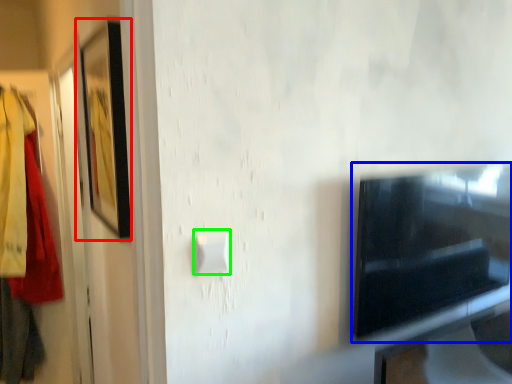
Question: Which is farther away from picture frame (highlighted by a red box)? appliance (highlighted by a blue box) or light switch (highlighted by a green box)?

Choices:
 (A) appliance
 (B) light switch

Answer: (A)